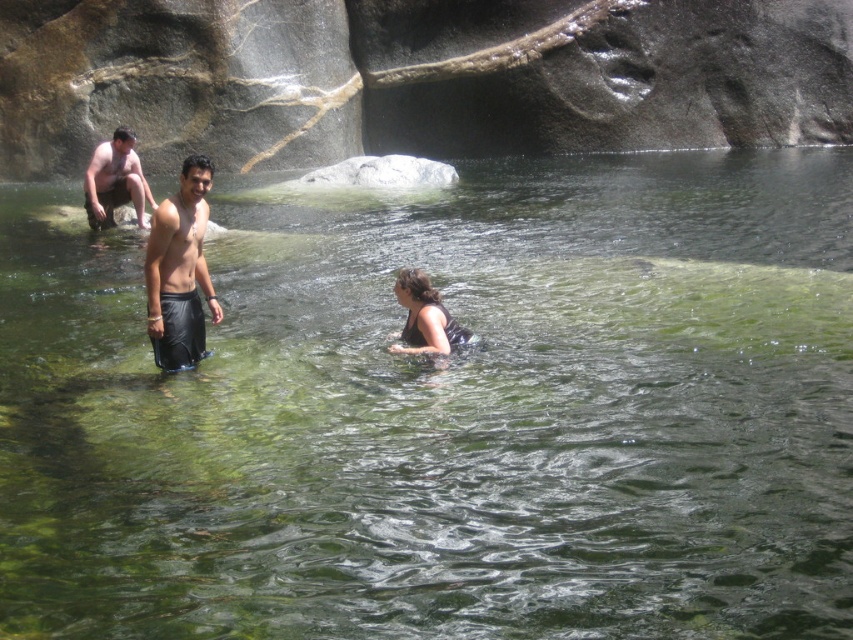
Question: Does black matte shorts at center have a lesser width compared to matte skin man at upper left?

Choices:
 (A) no
 (B) yes

Answer: (B)

Question: Which point appears closest to the camera in this image?

Choices:
 (A) (107, 221)
 (B) (402, 291)
 (C) (163, 275)

Answer: (C)

Question: Which object is farther from the camera taking this photo?

Choices:
 (A) black matte swimsuit at center
 (B) matte skin man at upper left

Answer: (B)

Question: Which object is farther from the camera taking this photo?

Choices:
 (A) black matte swimsuit at center
 (B) matte skin man at upper left
 (C) black matte shorts at center

Answer: (B)

Question: Is matte skin man at upper left in front of black matte swimsuit at center?

Choices:
 (A) no
 (B) yes

Answer: (A)

Question: Does black matte shorts at center appear on the right side of black matte swimsuit at center?

Choices:
 (A) yes
 (B) no

Answer: (B)